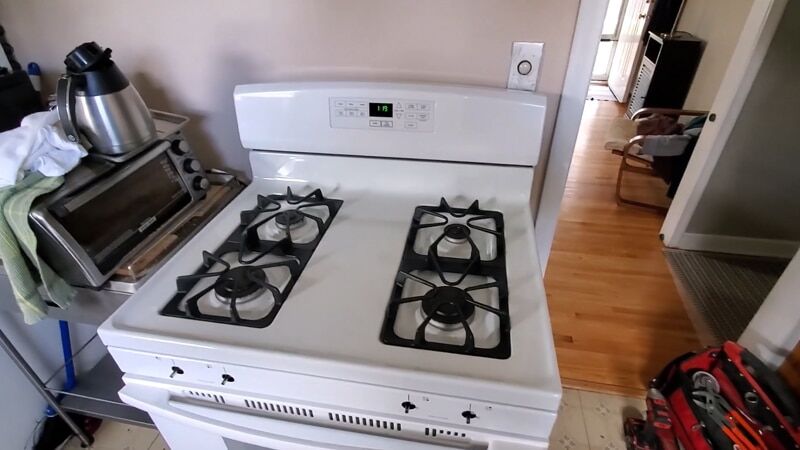
Where is `outlet`? outlet is located at coordinates (536, 62).